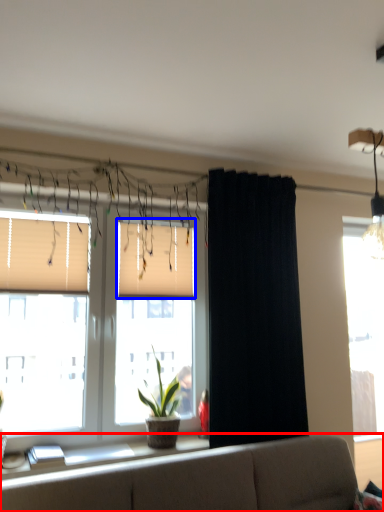
Question: Which point is further to the camera, studio couch (highlighted by a red box) or window blind (highlighted by a blue box)?

Choices:
 (A) studio couch
 (B) window blind

Answer: (B)